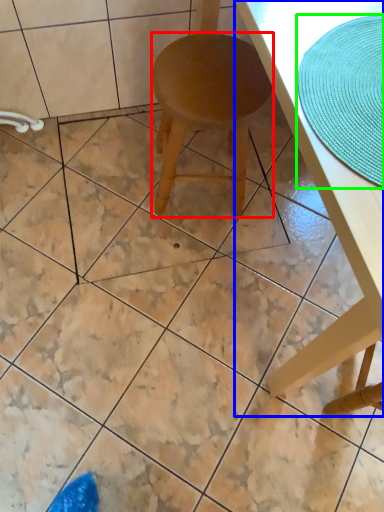
Question: Which object is the closest to the stool (highlighted by a red box)? Choose among these: table (highlighted by a blue box) or mat (highlighted by a green box).

Choices:
 (A) table
 (B) mat

Answer: (A)